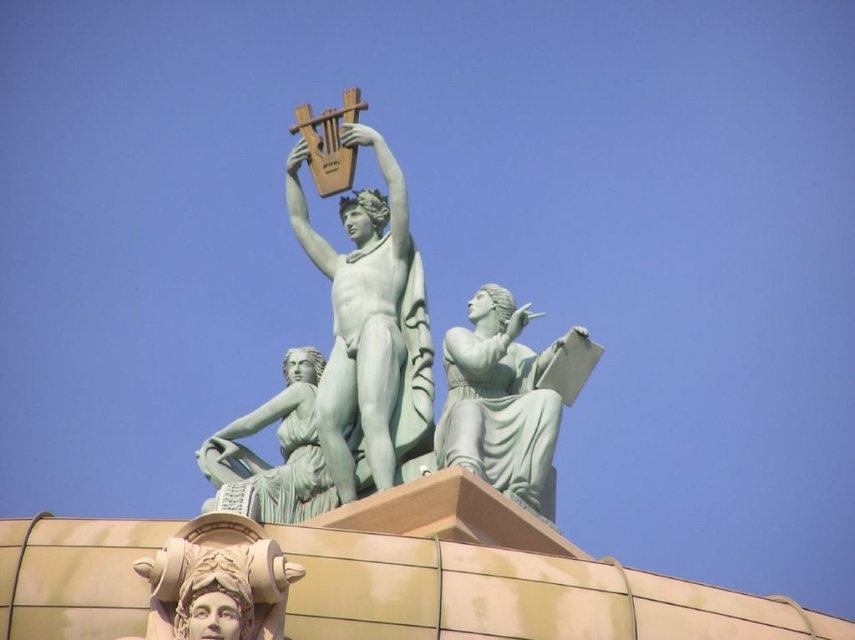
Based on the photo, does green marble lyre at center have a smaller size compared to green marble statue at center?

Actually, green marble lyre at center might be larger than green marble statue at center.

Does green marble lyre at center have a lesser height compared to green marble statue at center?

Incorrect, green marble lyre at center's height does not fall short of green marble statue at center's.

Does point (411, 253) come behind point (535, 314)?

Yes, it is behind point (535, 314).

Identify the location of green marble lyre at center. click(x=369, y=326).

Is green marble lyre at center to the right of smooth beige statue at lower center from the viewer's perspective?

Indeed, green marble lyre at center is positioned on the right side of smooth beige statue at lower center.

Which is in front, point (370, 444) or point (242, 531)?

Point (242, 531)

Who is more distant from viewer, (416, 250) or (175, 573)?

The point (416, 250) is behind.

This screenshot has height=640, width=855. In order to click on green marble lyre at center in this screenshot , I will do `click(369, 326)`.

Between green marble lyre at center and green patina statue at lower left, which one has less height?

Standing shorter between the two is green patina statue at lower left.

Is green marble lyre at center shorter than green patina statue at lower left?

No.

Is point (416, 342) closer to viewer compared to point (246, 488)?

No, (416, 342) is behind (246, 488).

Locate an element on the screen. green marble lyre at center is located at coordinates (369, 326).